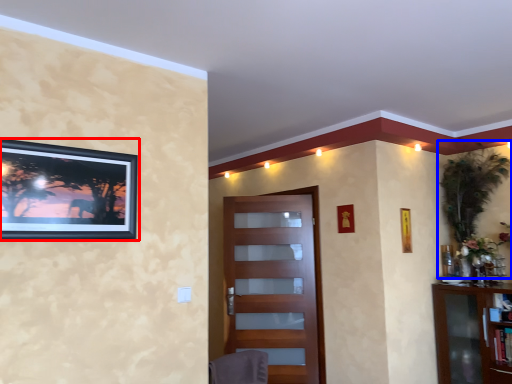
Question: Among these objects, which one is nearest to the camera, picture frame (highlighted by a red box) or plant (highlighted by a blue box)?

Choices:
 (A) picture frame
 (B) plant

Answer: (A)